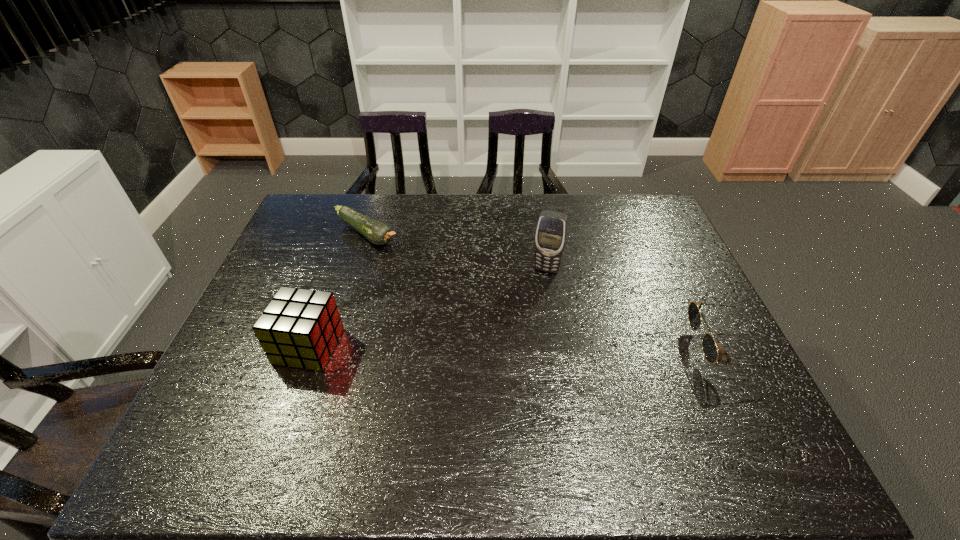
Identify the location of vacant area that lies between the shortest object and the second shortest object. (546, 291).

Find the location of a particular element. The width and height of the screenshot is (960, 540). unoccupied position between the cube and the zucchini is located at coordinates (338, 290).

This screenshot has width=960, height=540. What are the coordinates of `free area in between the tallest object and the second shortest object` in the screenshot? It's located at (636, 308).

In order to click on vacant region between the shortest object and the rightmost object in this screenshot , I will do `click(546, 291)`.

Identify the location of vacant space that is in between the second shortest object and the shortest object. (546, 291).

This screenshot has height=540, width=960. What are the coordinates of `unoccupied area between the second shortest object and the tallest object` in the screenshot? It's located at (636, 308).

Choose which object is the nearest neighbor to the zucchini. Please provide its 2D coordinates. Your answer should be formatted as a tuple, i.e. [(x, y)], where the tuple contains the x and y coordinates of a point satisfying the conditions above.

[(299, 328)]

You are a GUI agent. You are given a task and a screenshot of the screen. Output one action in this format:
    pyautogui.click(x=<x>, y=<y>)
    Task: Click on the object that is the second nearest to the sunglasses
    The height and width of the screenshot is (540, 960).
    Given the screenshot: What is the action you would take?
    pyautogui.click(x=378, y=233)

At what (x,y) coordinates should I click in order to perform the action: click on vacant region that satisfies the following two spatial constraints: 1. on the front side of the second shortest object; 2. on the front lenses of the third shortest object. Please return your answer as a coordinate pair (x, y). Looking at the image, I should click on (308, 347).

You are a GUI agent. You are given a task and a screenshot of the screen. Output one action in this format:
    pyautogui.click(x=<x>, y=<y>)
    Task: Click on the blank area in the image that satisfies the following two spatial constraints: 1. on the back side of the shortest object; 2. on the left side of the cube
    The height and width of the screenshot is (540, 960).
    Given the screenshot: What is the action you would take?
    pyautogui.click(x=348, y=234)